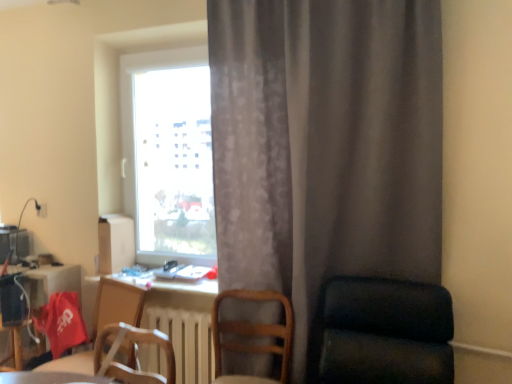
The height and width of the screenshot is (384, 512). What do you see at coordinates (186, 341) in the screenshot?
I see `white wooden radiator at center` at bounding box center [186, 341].

The width and height of the screenshot is (512, 384). What do you see at coordinates (49, 378) in the screenshot?
I see `white glossy table at lower left` at bounding box center [49, 378].

This screenshot has width=512, height=384. Describe the element at coordinates (168, 154) in the screenshot. I see `transparent glass window at center` at that location.

Where is `wooden chair at lower left, the 3th chair when ordered from right to left`? The image size is (512, 384). wooden chair at lower left, the 3th chair when ordered from right to left is located at coordinates (117, 304).

The height and width of the screenshot is (384, 512). I want to click on wooden chair at lower center, the 2th chair viewed from the right, so click(x=253, y=336).

In terms of width, does transparent glass window at center look wider or thinner when compared to matte black computer desk at lower left?

In the image, transparent glass window at center appears to be more narrow than matte black computer desk at lower left.

Measure the distance from transparent glass window at center to matte black computer desk at lower left.

The distance of transparent glass window at center from matte black computer desk at lower left is 39.00 inches.

Between transparent glass window at center and matte black computer desk at lower left, which one has more height?

Standing taller between the two is transparent glass window at center.

In order to click on window behind the matte black computer desk at lower left in this screenshot , I will do `click(168, 154)`.

Is point (283, 295) closer to camera compared to point (254, 200)?

No, it is behind (254, 200).

From a real-world perspective, between wooden chair at lower center, the 2th chair viewed from the right, and gray textured curtain at center, who is vertically higher?

gray textured curtain at center.

How distant is wooden chair at lower center, the 2th chair viewed from the right, from gray textured curtain at center?

22.18 inches.

Is matte black computer desk at lower left completely or partially outside of white glossy table at lower left?

matte black computer desk at lower left is positioned outside white glossy table at lower left.

Considering the sizes of matte black computer desk at lower left and white glossy table at lower left in the image, is matte black computer desk at lower left taller or shorter than white glossy table at lower left?

Clearly, matte black computer desk at lower left is taller compared to white glossy table at lower left.

Which object is thinner, matte black computer desk at lower left or white glossy table at lower left?

white glossy table at lower left is thinner.

From a real-world perspective, is matte black computer desk at lower left under white glossy table at lower left?

Yes, from a real-world perspective, matte black computer desk at lower left is beneath white glossy table at lower left.

Considering the positions of objects transparent glass window at center and white glossy table at lower left in the image provided, who is more to the left, transparent glass window at center or white glossy table at lower left?

Positioned to the left is white glossy table at lower left.

Looking at this image, is transparent glass window at center facing towards white glossy table at lower left?

Yes, transparent glass window at center is turned towards white glossy table at lower left.

Which of these two, transparent glass window at center or white glossy table at lower left, stands taller?

Standing taller between the two is transparent glass window at center.

Is transparent glass window at center thinner than white glossy table at lower left?

Yes.

Is wooden chair at lower center, the 2th chair viewed from the right, not near white wooden radiator at center?

wooden chair at lower center, the 2th chair viewed from the right, is near white wooden radiator at center, not far away.

From a real-world perspective, does wooden chair at lower center, the second chair from the left, stand above white wooden radiator at center?

Yes, from a real-world perspective, wooden chair at lower center, the second chair from the left, is over white wooden radiator at center

In the image, is wooden chair at lower center, the 2th chair viewed from the right, positioned in front of or behind white wooden radiator at center?

wooden chair at lower center, the 2th chair viewed from the right, is positioned closer to the viewer than white wooden radiator at center.

Which is in front, point (39, 279) or point (157, 358)?

The point (157, 358) is more forward.

From a real-world perspective, which object stands above the other?

matte black computer desk at lower left.

Considering the sizes of objects matte black computer desk at lower left and white wooden radiator at center in the image provided, who is bigger, matte black computer desk at lower left or white wooden radiator at center?

matte black computer desk at lower left is bigger.

Is matte black computer desk at lower left aimed at white wooden radiator at center?

Yes, matte black computer desk at lower left is turned towards white wooden radiator at center.

Who is more distant, white wooden radiator at center or transparent glass window at center?

transparent glass window at center is behind.

Choose the correct answer: Is white wooden radiator at center inside transparent glass window at center or outside it?

white wooden radiator at center cannot be found inside transparent glass window at center.

Which object is thinner, white wooden radiator at center or transparent glass window at center?

white wooden radiator at center.

The height and width of the screenshot is (384, 512). Find the location of `window behind the matte black computer desk at lower left`. window behind the matte black computer desk at lower left is located at coordinates (168, 154).

The image size is (512, 384). In order to click on chair that is the 2nd object located below the gray textured curtain at center (from the image's perspective) in this screenshot , I will do `click(253, 336)`.

Which object lies nearer to the anchor point wooden chair at lower left, the 3th chair when ordered from right to left, transparent glass window at center or gray textured curtain at center?

Based on the image, transparent glass window at center appears to be nearer to wooden chair at lower left, the 3th chair when ordered from right to left.

Based on the photo, which object lies further to the anchor point white glossy table at lower left, white wooden radiator at center or wooden chair at lower left, the 3th chair when ordered from right to left?

Based on the image, white wooden radiator at center appears to be further to white glossy table at lower left.

Looking at the image, which one is located closer to wooden chair at lower center, the 2th chair viewed from the right, transparent glass window at center or white glossy table at lower left?

white glossy table at lower left.

Based on their spatial positions, is transparent glass window at center or white glossy table at lower left further from gray textured curtain at center?

The object further to gray textured curtain at center is white glossy table at lower left.

In the scene shown: Considering their positions, is wooden chair at lower left, the 3th chair when ordered from right to left, positioned closer to wooden chair at lower center, the second chair from the left, than transparent glass window at center?

Based on the image, wooden chair at lower left, the 3th chair when ordered from right to left, appears to be nearer to wooden chair at lower center, the second chair from the left.

Which object lies further to the anchor point matte black computer desk at lower left, white glossy table at lower left or wooden chair at lower left, the 3th chair when ordered from right to left?

white glossy table at lower left lies further to matte black computer desk at lower left than the other object.

Which object lies nearer to the anchor point white wooden radiator at center, white glossy table at lower left or wooden chair at lower center, the 2th chair viewed from the right?

wooden chair at lower center, the 2th chair viewed from the right, is positioned closer to the anchor white wooden radiator at center.

Which object lies further to the anchor point white glossy table at lower left, gray textured curtain at center or matte black computer desk at lower left?

gray textured curtain at center is positioned further to the anchor white glossy table at lower left.

Identify the location of curtain between white glossy table at lower left and white wooden radiator at center in the front-back direction. Image resolution: width=512 pixels, height=384 pixels. (325, 148).

You are a GUI agent. You are given a task and a screenshot of the screen. Output one action in this format:
    pyautogui.click(x=<x>, y=<y>)
    Task: Click on the chair between white glossy table at lower left and gray textured curtain at center from left to right
    The height and width of the screenshot is (384, 512).
    Given the screenshot: What is the action you would take?
    pyautogui.click(x=253, y=336)

Identify the location of curtain located between white glossy table at lower left and dark green fabric chair at right, which appears as the first chair when viewed from the right, in the left-right direction. The width and height of the screenshot is (512, 384). (325, 148).

Locate an element on the screen. This screenshot has height=384, width=512. table between wooden chair at lower left, the 3th chair when ordered from right to left, and dark green fabric chair at right, which is counted as the third chair, starting from the left is located at coordinates (49, 378).